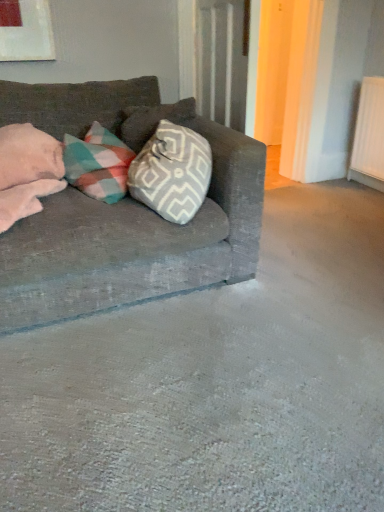
Question: Considering the relative positions of textured gray couch at left and pink soft pillow at left in the image provided, is textured gray couch at left to the right of pink soft pillow at left from the viewer's perspective?

Choices:
 (A) no
 (B) yes

Answer: (B)

Question: Is textured gray couch at left to the left of pink soft pillow at left from the viewer's perspective?

Choices:
 (A) no
 (B) yes

Answer: (A)

Question: Can we say textured gray couch at left lies outside pink soft pillow at left?

Choices:
 (A) no
 (B) yes

Answer: (B)

Question: Is textured gray couch at left smaller than pink soft pillow at left?

Choices:
 (A) no
 (B) yes

Answer: (A)

Question: Does textured gray couch at left lie in front of pink soft pillow at left?

Choices:
 (A) no
 (B) yes

Answer: (B)

Question: Could you tell me if textured gray couch at left is facing pink soft pillow at left?

Choices:
 (A) no
 (B) yes

Answer: (A)

Question: From a real-world perspective, is pink soft pillow at left on top of textured gray couch at left?

Choices:
 (A) yes
 (B) no

Answer: (A)

Question: Can you confirm if pink soft pillow at left is positioned to the right of textured gray couch at left?

Choices:
 (A) yes
 (B) no

Answer: (B)

Question: From a real-world perspective, is pink soft pillow at left below textured gray couch at left?

Choices:
 (A) no
 (B) yes

Answer: (A)

Question: From the image's perspective, would you say pink soft pillow at left is positioned over textured gray couch at left?

Choices:
 (A) no
 (B) yes

Answer: (B)

Question: Can we say pink soft pillow at left lies outside textured gray couch at left?

Choices:
 (A) no
 (B) yes

Answer: (A)

Question: Can you confirm if pink soft pillow at left is shorter than textured gray couch at left?

Choices:
 (A) no
 (B) yes

Answer: (B)

Question: Is pink soft pillow at left bigger or smaller than textured gray couch at left?

Choices:
 (A) small
 (B) big

Answer: (A)